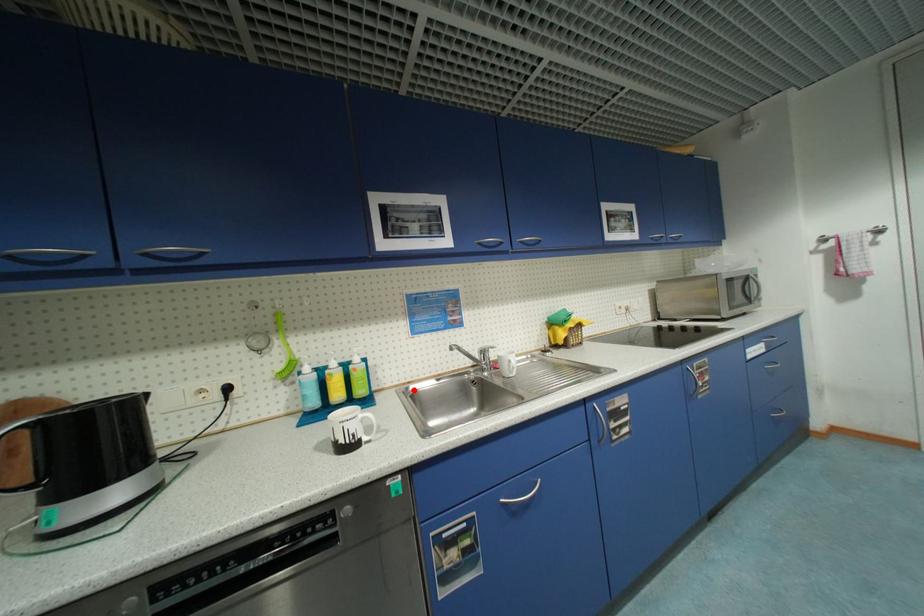
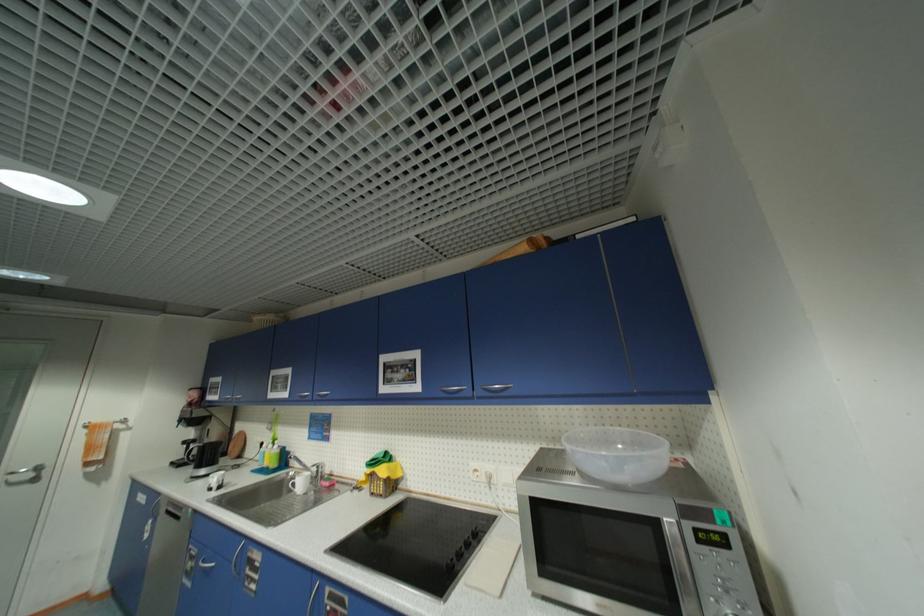
Find the pixel in the second image that matches the highlighted location in the first image.

(294, 475)